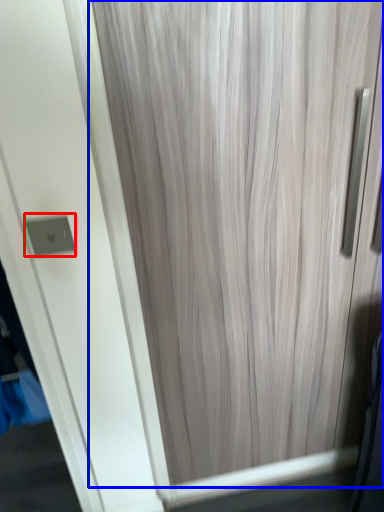
Question: Which object appears farthest to the camera in this image, electric outlet (highlighted by a red box) or curtain (highlighted by a blue box)?

Choices:
 (A) electric outlet
 (B) curtain

Answer: (A)